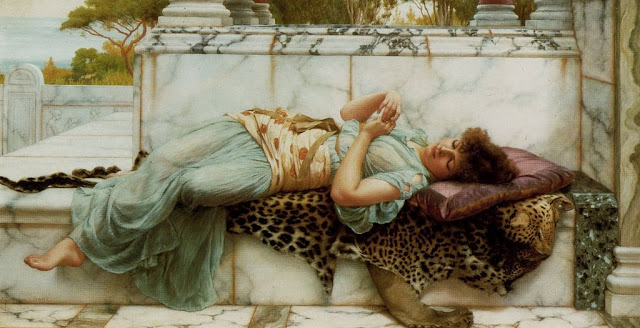
Locate an element on the screen. The width and height of the screenshot is (640, 328). floor is located at coordinates (322, 313).